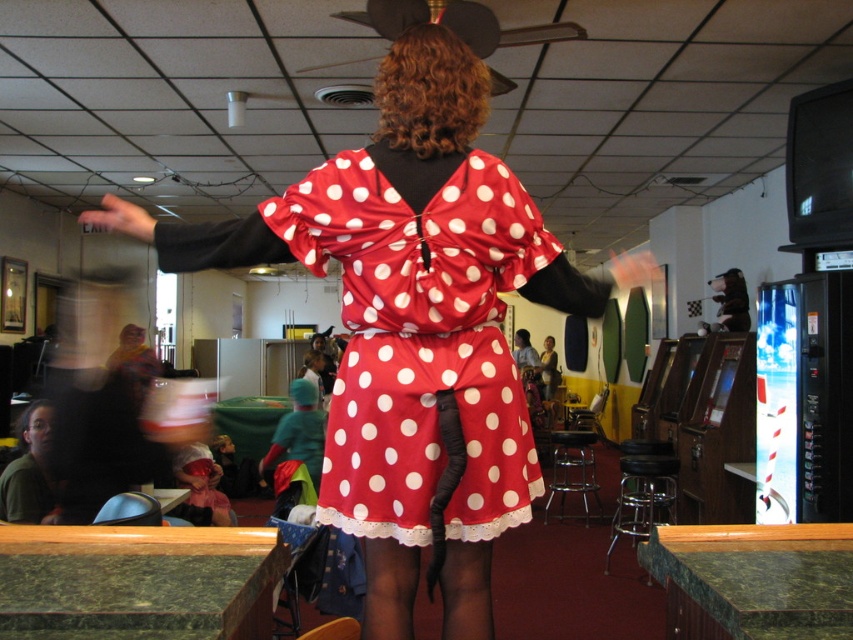
Is silky red dress at center above green matte shirt at lower left?

Correct, silky red dress at center is located above green matte shirt at lower left.

Locate an element on the screen. This screenshot has width=853, height=640. silky red dress at center is located at coordinates (410, 326).